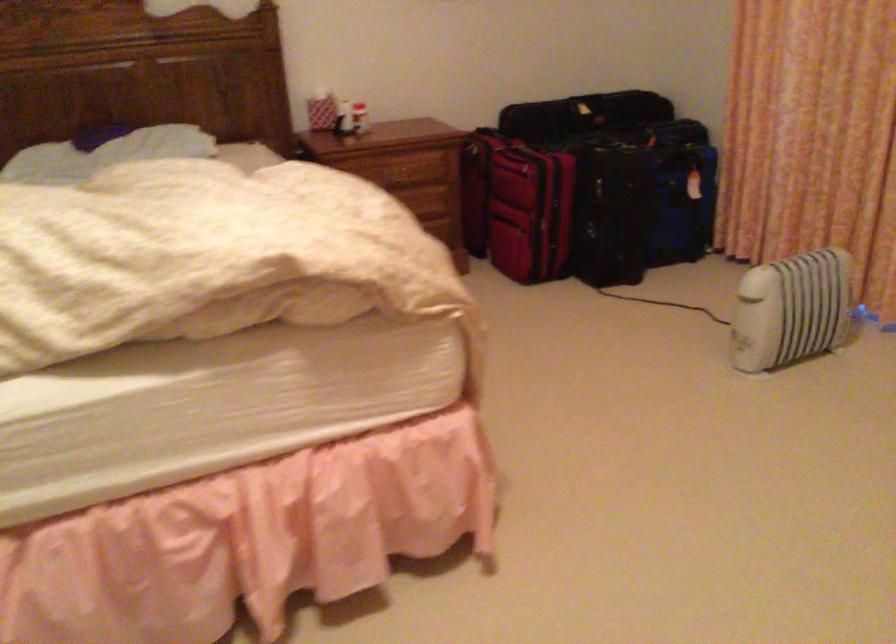
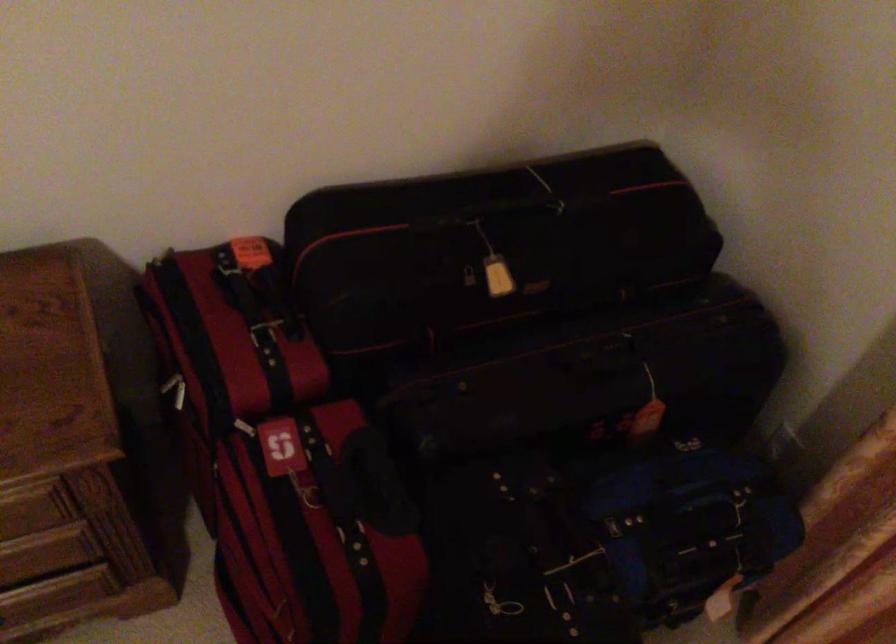
The point at [570,107] is marked in the first image. Where is the corresponding point in the second image?

(470, 287)